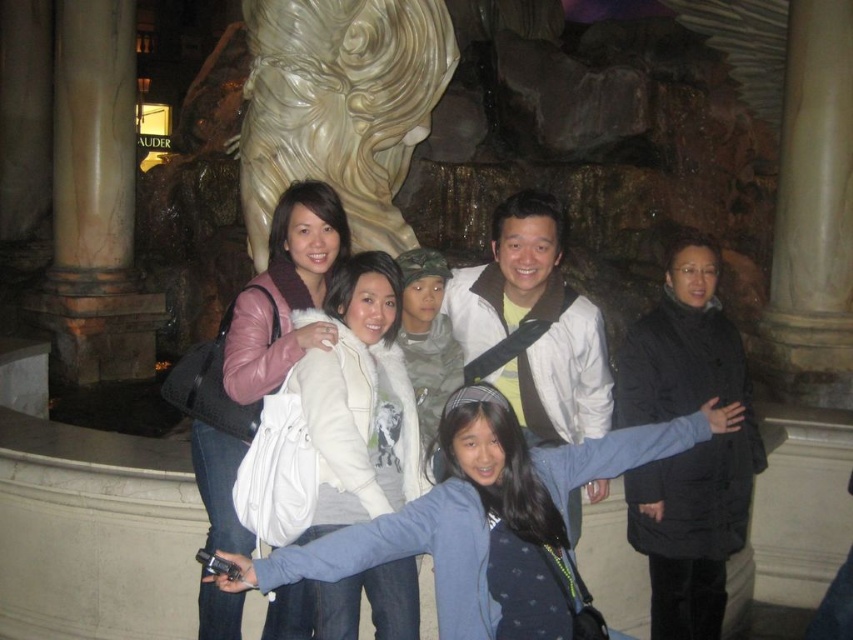
You are a photographer trying to capture a group photo of the light blue sweater at center and the marble column at left. The camera you have can only focus on objects within 30 meters. Will both subjects be in focus?

The distance between the light blue sweater at center and the marble column at left is 33.94 meters, which exceeds the camera focus range of 30 meters. Therefore, both subjects cannot be in focus simultaneously.

You are standing in front of the fountain and want to determine which of the two points, point (x=676, y=509) or point (x=219, y=545), is closer to you. Based on the scene, which point is nearer?

Point (x=676, y=509) is closer to you because it is further to the viewer than point (x=219, y=545).